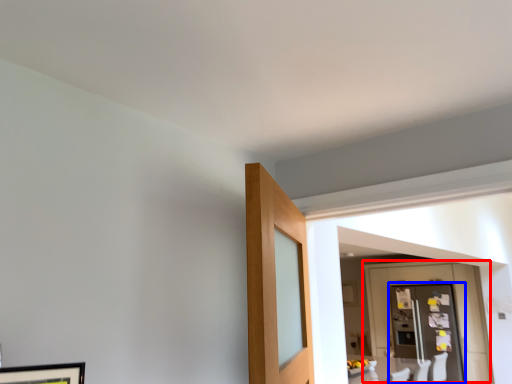
Question: Which point is further to the camera, door (highlighted by a red box) or glass door (highlighted by a blue box)?

Choices:
 (A) door
 (B) glass door

Answer: (B)